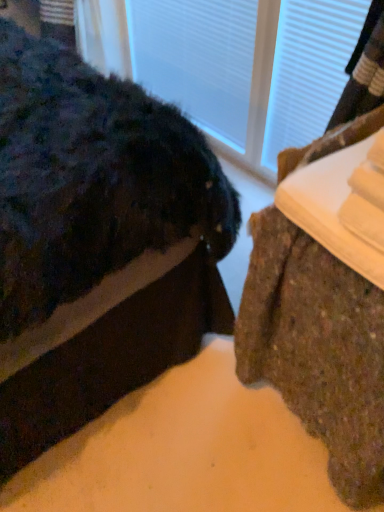
Find the location of a particular element. This screenshot has width=384, height=512. free spot to the left of brown textured rug at lower right, the second furniture when ordered from left to right is located at coordinates (178, 433).